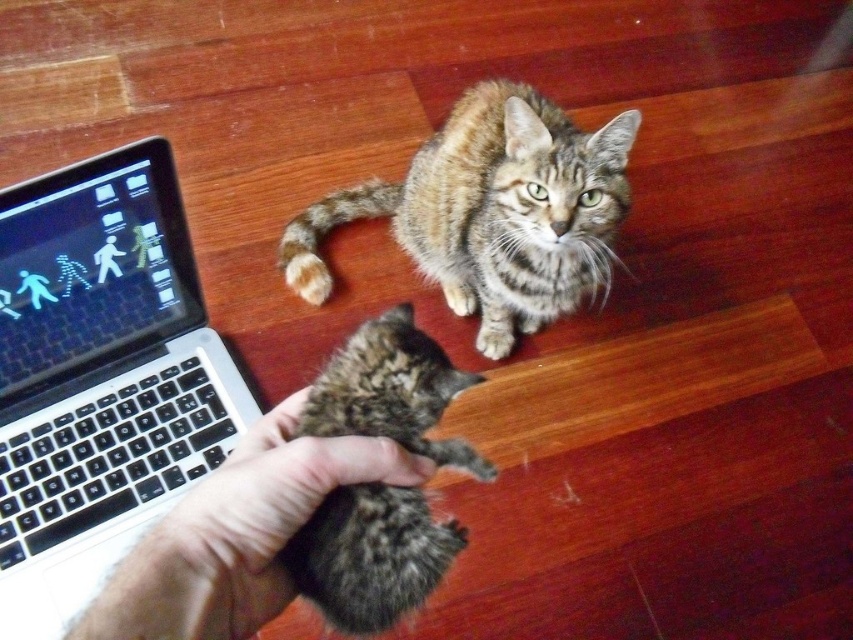
Question: Can you confirm if tabby fur kitten at center is thinner than soft brown fur paw at center?

Choices:
 (A) yes
 (B) no

Answer: (B)

Question: Does tabby fur cat at center have a smaller size compared to tabby fur kitten at center?

Choices:
 (A) yes
 (B) no

Answer: (B)

Question: Which is farther from the black plastic laptop at left?

Choices:
 (A) soft brown fur paw at center
 (B) tabby fur kitten at center

Answer: (A)

Question: Based on their relative distances, which object is nearer to the soft brown fur paw at center?

Choices:
 (A) fur at center
 (B) tabby fur cat at center
 (C) tabby fur kitten at center

Answer: (B)

Question: Is tabby fur cat at center further to the viewer compared to tabby fur kitten at center?

Choices:
 (A) yes
 (B) no

Answer: (A)

Question: Which point is farther to the camera?

Choices:
 (A) black plastic laptop at left
 (B) soft brown fur paw at center
 (C) fur at center

Answer: (B)